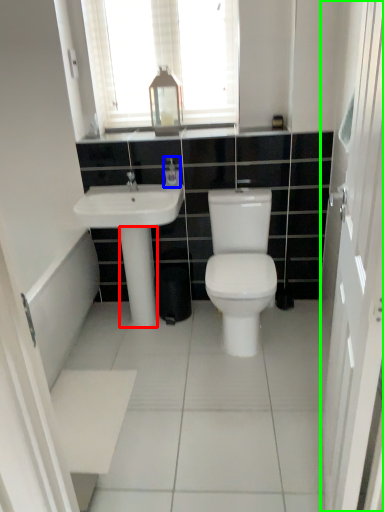
Question: Considering the real-world distances, which object is closest to pillar (highlighted by a red box)? toiletry (highlighted by a blue box) or screen door (highlighted by a green box).

Choices:
 (A) toiletry
 (B) screen door

Answer: (A)